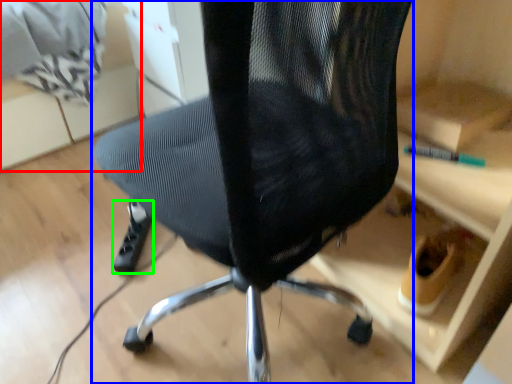
Question: Which object is the closest to the shelf (highlighted by a red box)? Choose among these: chair (highlighted by a blue box) or foot (highlighted by a green box).

Choices:
 (A) chair
 (B) foot

Answer: (B)